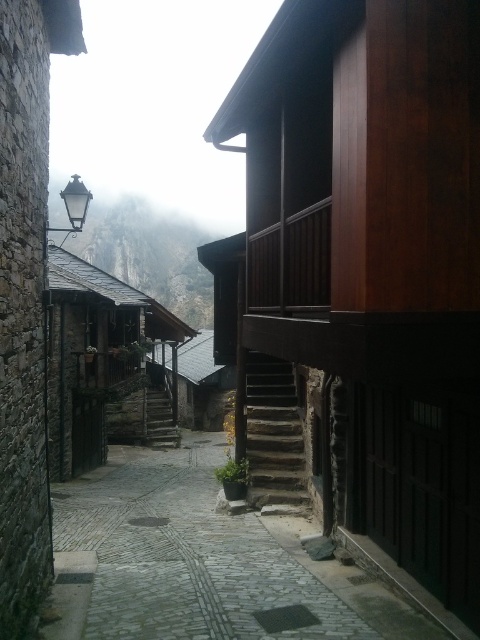
You are a tourist standing on the cobblestone path at center and want to take a photo of the rugged stone mountain at upper left. Which direction should you face to capture the mountain in your view?

You should face upward because the rugged stone mountain at upper left is above the cobblestone path at center.

You are a delivery person carrying a large package and need to walk through the cobblestone path at center and the stone textured stairs at center. Which path is wider and safer for carrying your heavy load?

The cobblestone path at center is wider than the stone textured stairs at center, making it safer for carrying a heavy load.

You are a tourist standing at the bottom of the street, looking up towards the rugged stone mountain at upper left and the stone textured stairs at center. Which object is positioned to the left of the other?

The rugged stone mountain at upper left is to the left of the stone textured stairs at center.